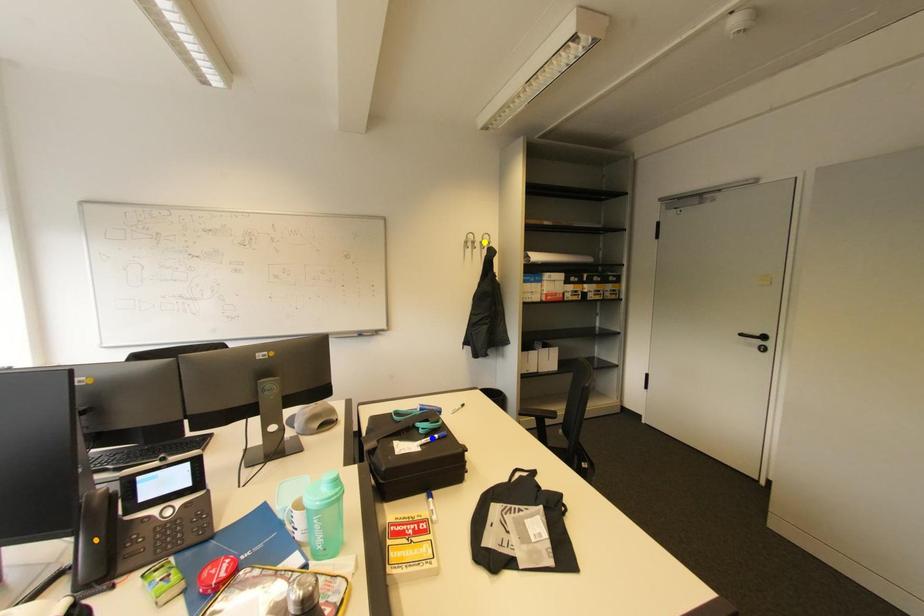
Order these from nearest to farthest:
orange point, blue point, yellow point

orange point < blue point < yellow point